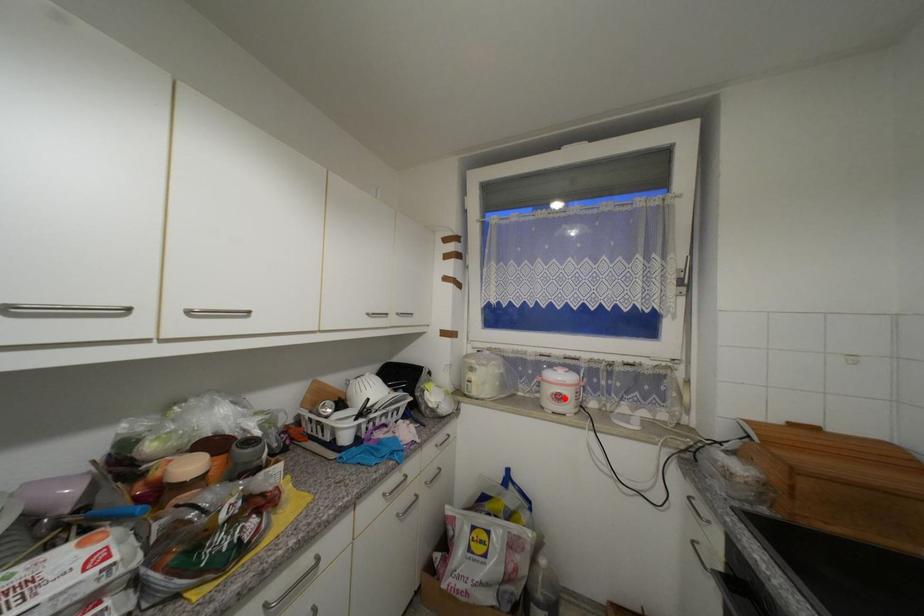
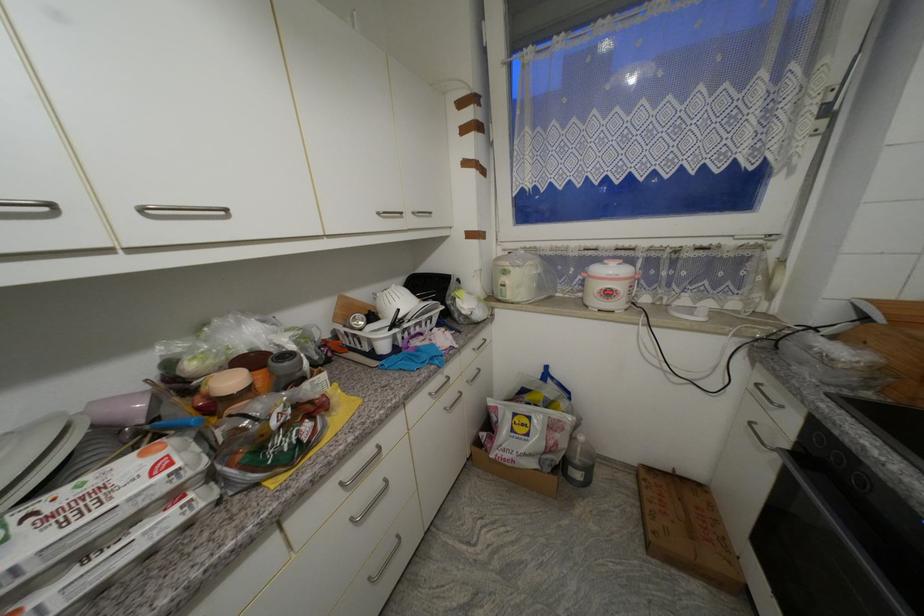
Question: I am providing you with two images of the same scene from different viewpoints. In image1, a red point is highlighted. Considering the same 3D point in image2, which of the following is correct?

Choices:
 (A) It is closer
 (B) It is farther

Answer: (A)